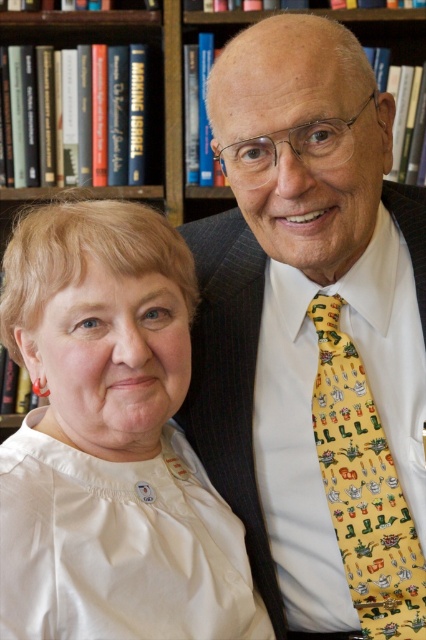
Measure the distance from yellow printed tie at right to white satin blouse at left.

yellow printed tie at right and white satin blouse at left are 17.62 centimeters apart from each other.

Measure the distance between point (213, 292) and camera.

Point (213, 292) is 3.38 feet away from camera.

Is point (221, 116) closer to viewer compared to point (227, 625)?

Yes.

Locate an element on the screen. Image resolution: width=426 pixels, height=640 pixels. yellow printed tie at right is located at coordinates (313, 333).

Locate an element on the screen. yellow printed tie at right is located at coordinates (313, 333).

Can you confirm if yellow printed tie at right is bigger than wooden bookshelf at upper center?

Correct, yellow printed tie at right is larger in size than wooden bookshelf at upper center.

The width and height of the screenshot is (426, 640). What do you see at coordinates (313, 333) in the screenshot?
I see `yellow printed tie at right` at bounding box center [313, 333].

What are the coordinates of `yellow printed tie at right` in the screenshot? It's located at (313, 333).

What do you see at coordinates (109, 442) in the screenshot? This screenshot has height=640, width=426. I see `white satin blouse at left` at bounding box center [109, 442].

Does point (51, 424) lie in front of point (359, 545)?

Yes.

Is point (150, 504) positioned behind point (322, 364)?

No.

Locate an element on the screen. The image size is (426, 640). white satin blouse at left is located at coordinates (109, 442).